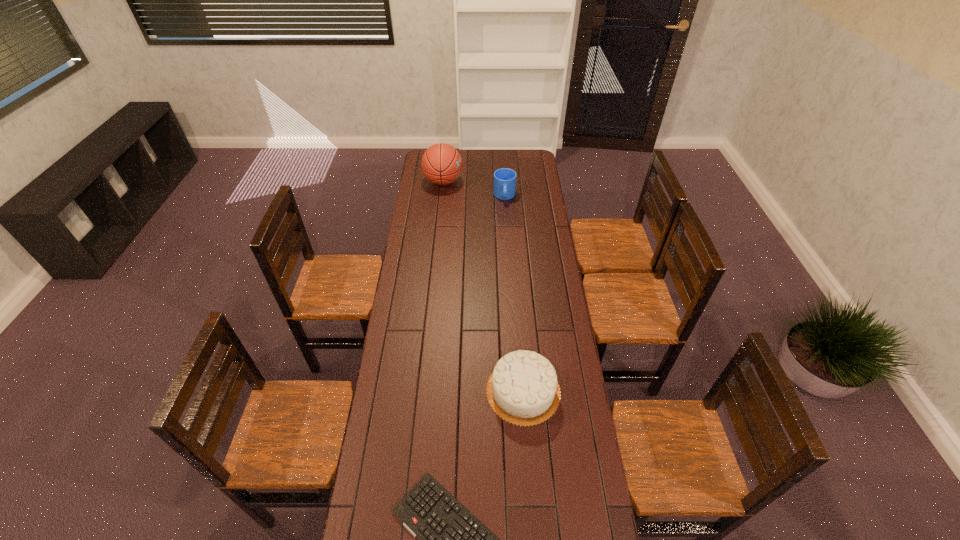
What are the coordinates of `vacant region that satisfies the following two spatial constraints: 1. on the side of the mug with the handle; 2. on the right side of the second nearest object` in the screenshot? It's located at (517, 391).